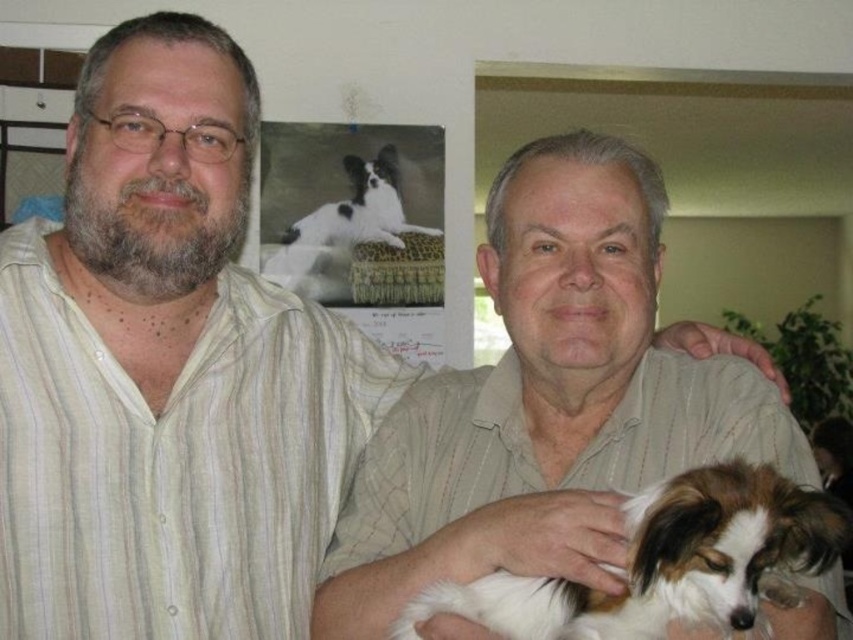
Based on the scene description, which dog is taller, the white and brown fur dog at center or the black and white fur dog at upper center?

The black and white fur dog at upper center is taller than the white and brown fur dog at center.

You are a photographer trying to capture the white and brown fur dog at center. The camera you are using has a focus point at coordinate 0.881, 0.787. Will the dog be in focus?

Yes, the white and brown fur dog at center is exactly at point (670, 563), so the camera focus point will capture it in focus.